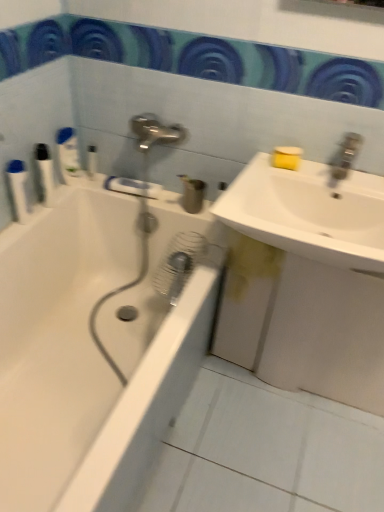
What are the coordinates of `free space that is to the left of white plastic towel bar at upper center` in the screenshot? It's located at (97, 186).